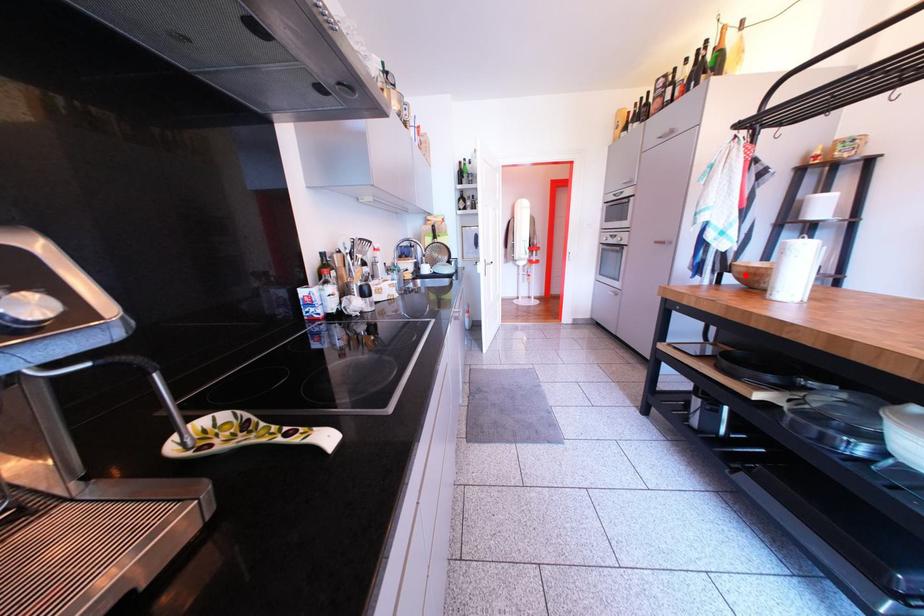
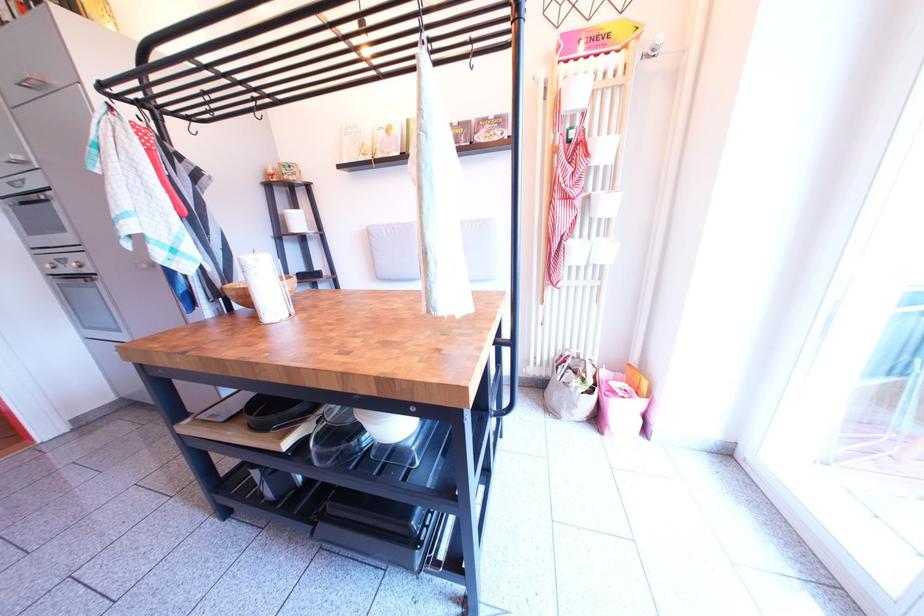
Find the pixel in the second image that matches the highlighted location in the first image.

(239, 299)